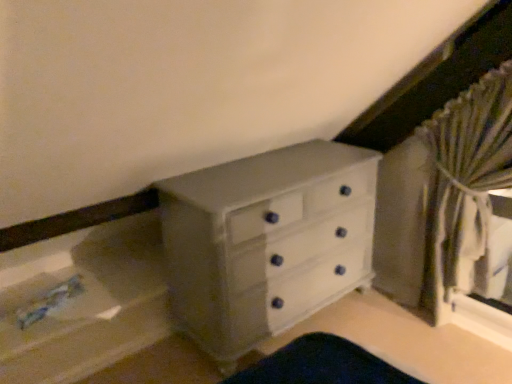
Question: Does point (422, 261) appear closer or farther from the camera than point (192, 256)?

Choices:
 (A) closer
 (B) farther

Answer: (B)

Question: Considering the positions of striped fabric curtain at right and white painted wood chest of drawers at center in the image, is striped fabric curtain at right wider or thinner than white painted wood chest of drawers at center?

Choices:
 (A) wide
 (B) thin

Answer: (B)

Question: Choose the correct answer: Is striped fabric curtain at right inside white painted wood chest of drawers at center or outside it?

Choices:
 (A) inside
 (B) outside

Answer: (B)

Question: Which is correct: white painted wood chest of drawers at center is inside striped fabric curtain at right, or outside of it?

Choices:
 (A) outside
 (B) inside

Answer: (A)

Question: From their relative heights in the image, would you say white painted wood chest of drawers at center is taller or shorter than striped fabric curtain at right?

Choices:
 (A) short
 (B) tall

Answer: (A)

Question: From the image's perspective, is white painted wood chest of drawers at center located above or below striped fabric curtain at right?

Choices:
 (A) below
 (B) above

Answer: (A)

Question: From a real-world perspective, relative to striped fabric curtain at right, is white painted wood chest of drawers at center vertically above or below?

Choices:
 (A) below
 (B) above

Answer: (A)